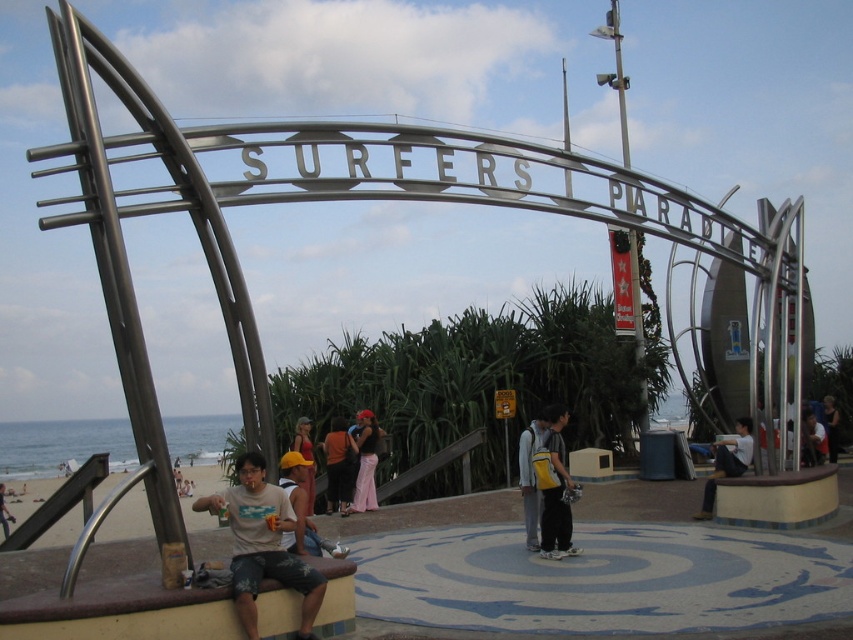
Question: Which point is farther to the camera?

Choices:
 (A) matte white t-shirt at center
 (B) orange fabric shirt at center
 (C) white shirt at center

Answer: (B)

Question: Can you confirm if yellow backpack at center is smaller than matte gray surfboard at lower left?

Choices:
 (A) yes
 (B) no

Answer: (B)

Question: Is matte yellow backpack at center below light brown wooden bench at center?

Choices:
 (A) yes
 (B) no

Answer: (B)

Question: Can you confirm if light brown wooden bench at center is positioned to the right of matte yellow hat at center?

Choices:
 (A) yes
 (B) no

Answer: (A)

Question: Among these objects, which one is nearest to the camera?

Choices:
 (A) matte black dress at center
 (B) matte yellow backpack at center
 (C) matte yellow hat at center
 (D) light brown wooden bench at center

Answer: (C)

Question: Which point appears farthest from the camera in this image?

Choices:
 (A) click(x=550, y=445)
 (B) click(x=352, y=442)
 (C) click(x=837, y=435)
 (D) click(x=309, y=497)

Answer: (C)